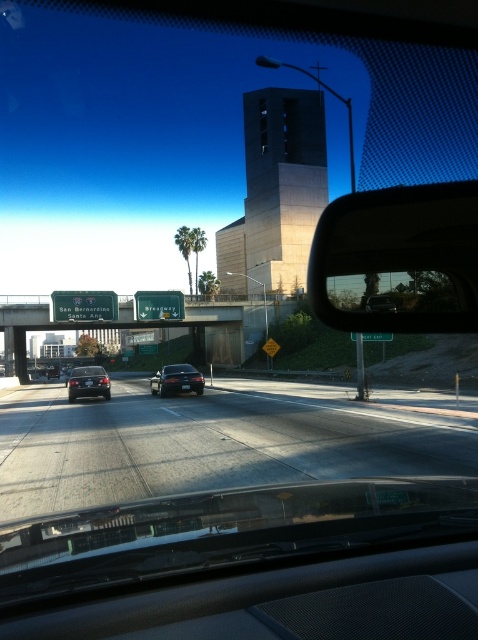
Question: Is green sign at upper center bigger than shiny black sedan at center?

Choices:
 (A) yes
 (B) no

Answer: (A)

Question: Which of the following is the closest to the observer?

Choices:
 (A) black asphalt highway at center
 (B) satin black sedan at center
 (C) green sign at upper center
 (D) black plastic side mirror at center-right

Answer: (D)

Question: Which object appears farthest from the camera in this image?

Choices:
 (A) black asphalt highway at center
 (B) green sign at upper center

Answer: (B)

Question: Which point is closer to the camera taking this photo?

Choices:
 (A) (447, 445)
 (B) (86, 388)

Answer: (A)

Question: Can you confirm if black plastic side mirror at center-right is positioned to the left of satin black sedan at center?

Choices:
 (A) no
 (B) yes

Answer: (A)

Question: Does green sign at upper center have a smaller size compared to green matte highway sign at upper left?

Choices:
 (A) yes
 (B) no

Answer: (B)